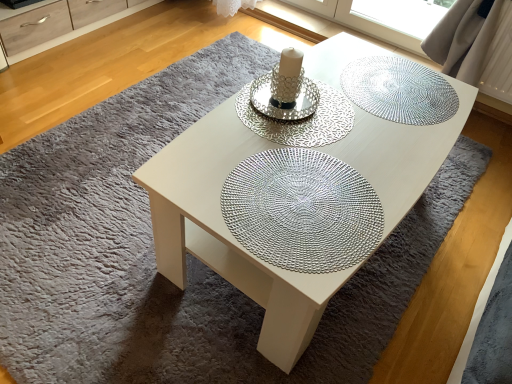
Identify the location of vacant space that is to the left of white glossy coffee table at center. (95, 195).